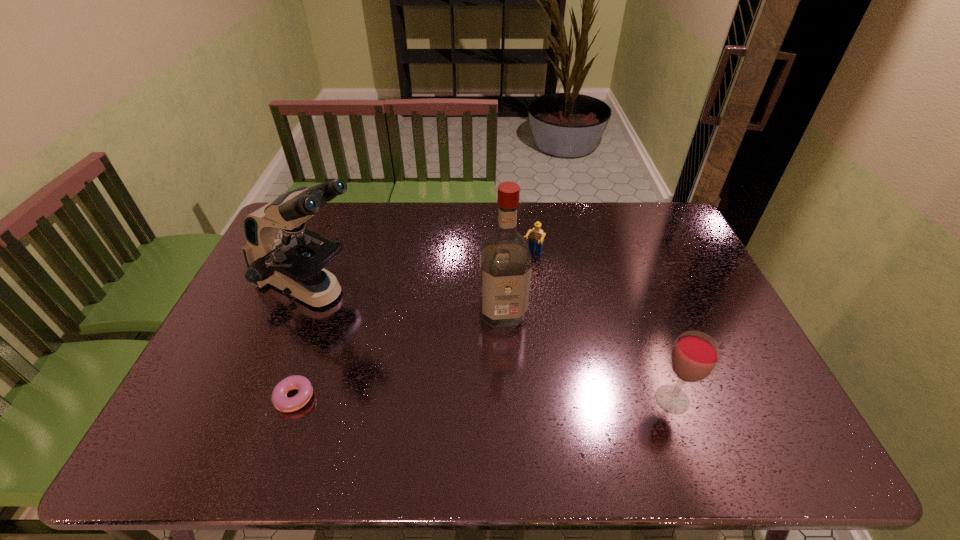
The height and width of the screenshot is (540, 960). Identify the location of free area in between the liquor and the microscope. (408, 301).

The width and height of the screenshot is (960, 540). In order to click on vacant region between the rightmost object and the fourth object from left to right in this screenshot , I will do `click(602, 327)`.

Where is `free space that is in between the wineglass and the microscope`? The height and width of the screenshot is (540, 960). free space that is in between the wineglass and the microscope is located at coordinates (493, 345).

I want to click on free space between the second object from right to left and the doughnut, so click(x=413, y=327).

Find the location of a particular element. free space between the doughnut and the fourth tallest object is located at coordinates (413, 327).

You are a GUI agent. You are given a task and a screenshot of the screen. Output one action in this format:
    pyautogui.click(x=<x>, y=<y>)
    Task: Click on the empty location between the microscope and the third tallest object
    The width and height of the screenshot is (960, 540).
    Given the screenshot: What is the action you would take?
    pyautogui.click(x=493, y=345)

Identify the location of empty location between the microscope and the doughnut. (304, 345).

This screenshot has width=960, height=540. I want to click on object that is the nearest to the microscope, so click(281, 402).

Locate which object is the third closest to the microscope. Please provide its 2D coordinates. Your answer should be formatted as a tuple, i.e. [(x, y)], where the tuple contains the x and y coordinates of a point satisfying the conditions above.

[(536, 238)]